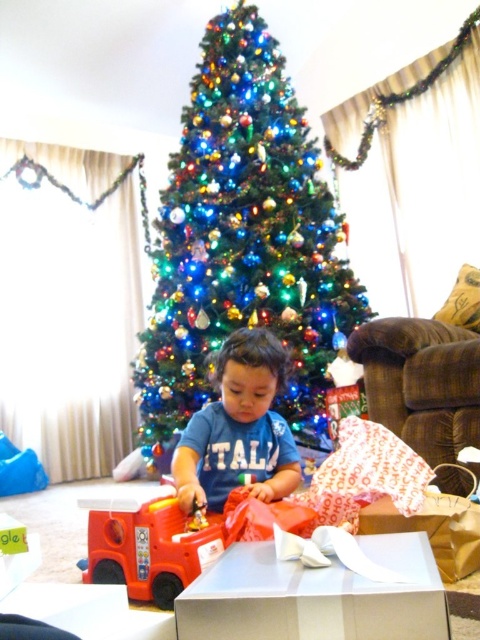
Question: Does green artificial christmas tree at center appear under matte blue shirt at center?

Choices:
 (A) yes
 (B) no

Answer: (B)

Question: Is white glossy box at center thinner than gold paper bag at lower right?

Choices:
 (A) no
 (B) yes

Answer: (A)

Question: Which object is farther from the camera taking this photo?

Choices:
 (A) matte blue shirt at center
 (B) gold paper bag at lower right
 (C) rubber fire truck at lower left

Answer: (A)

Question: Is green artificial christmas tree at center positioned behind matte blue shirt at center?

Choices:
 (A) no
 (B) yes

Answer: (B)

Question: Which is farther from the rubber fire truck at lower left?

Choices:
 (A) gold paper bag at lower right
 (B) matte blue shirt at center

Answer: (A)

Question: Which of the following is the closest to the observer?

Choices:
 (A) rubber fire truck at lower left
 (B) matte blue shirt at center

Answer: (A)